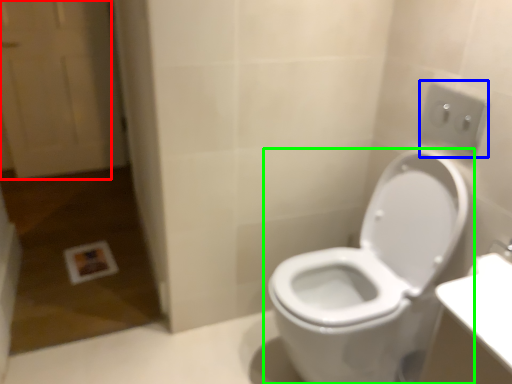
Question: Based on their relative distances, which object is farther from screen door (highlighted by a red box)? Choose from electric outlet (highlighted by a blue box) and toilet (highlighted by a green box).

Choices:
 (A) electric outlet
 (B) toilet

Answer: (A)